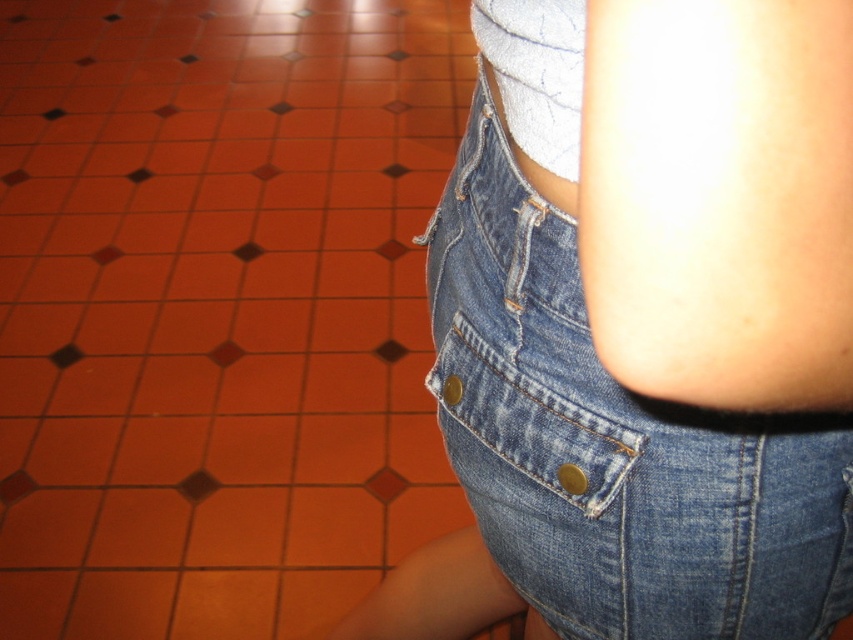
You are a tailor measuring the distance between the orange tile at center and the denim pocket at lower right for a custom fit. Which object is taller?

The orange tile at center is much taller than the denim pocket at lower right.

You are standing at the origin point in the image. There are two points marked in the scene. Which point is closer to you, point (x=170, y=118) or point (x=573, y=368)?

Point (x=573, y=368) is closer to you because it is in front of point (x=170, y=118).

You are standing in a room with the tiled floor shown. You want to place a 24 inch ruler exactly at the point labeled point [473,444]. Will the ruler fit perfectly at that point without extending beyond it?

The point [473,444] is 24.50 inches from the viewer. Since the ruler is 24 inches long, it will fit perfectly at that point as it is slightly shorter than the distance from the viewer.